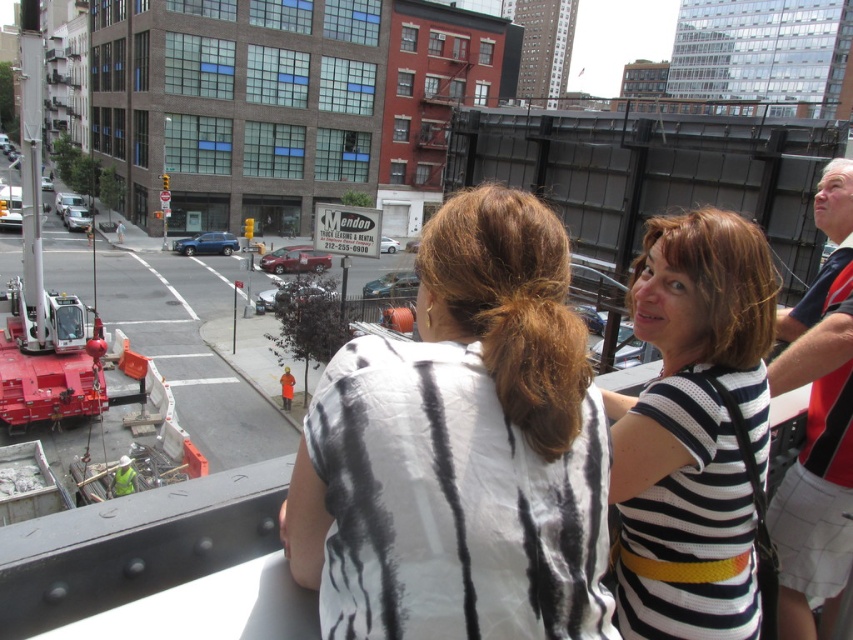
Is white striped shirt at center positioned in front of striped cotton shirt at center?

Yes, it is in front of striped cotton shirt at center.

Which of these two, white striped shirt at center or striped cotton shirt at center, stands shorter?

white striped shirt at center is shorter.

I want to click on white striped shirt at center, so 461,451.

Where is `white striped shirt at center`? white striped shirt at center is located at coordinates (461, 451).

Between point (363, 614) and point (838, 374), which one is positioned in front?

Point (363, 614) is more forward.

Which is more to the left, white striped shirt at center or white and red polo shirt at upper right?

Positioned to the left is white striped shirt at center.

At what (x,y) coordinates should I click in order to perform the action: click on white striped shirt at center. Please return your answer as a coordinate pair (x, y). The width and height of the screenshot is (853, 640). Looking at the image, I should click on (461, 451).

Identify the location of white striped shirt at center. (461, 451).

Which is behind, point (729, 332) or point (793, 467)?

The point (793, 467) is more distant.

Is point (737, 483) farther from camera compared to point (804, 630)?

No, it is not.

Who is more distant from viewer, (682, 304) or (819, 444)?

The point (819, 444) is behind.

Where is `striped cotton shirt at center`? The height and width of the screenshot is (640, 853). striped cotton shirt at center is located at coordinates (693, 432).